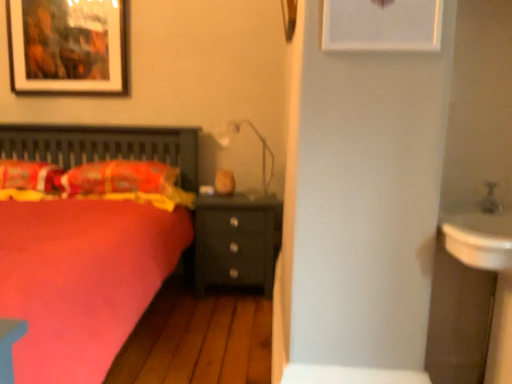
Question: From a real-world perspective, is fluffy orange pillow at left, which is counted as the first pillow, starting from the left, on matte black picture frame at upper left, acting as the 1th picture frame starting from the left?

Choices:
 (A) no
 (B) yes

Answer: (A)

Question: Is matte black picture frame at upper left, which is counted as the second picture frame, starting from the right, a part of fluffy orange pillow at left, which is the second pillow in right-to-left order?

Choices:
 (A) yes
 (B) no

Answer: (B)

Question: From a real-world perspective, does fluffy orange pillow at left, which is counted as the first pillow, starting from the left, sit lower than matte black picture frame at upper left, the 1th picture frame from the back?

Choices:
 (A) yes
 (B) no

Answer: (A)

Question: Considering the relative positions of fluffy orange pillow at left, which is counted as the first pillow, starting from the left, and matte black picture frame at upper left, which is counted as the second picture frame, starting from the right, in the image provided, is fluffy orange pillow at left, which is counted as the first pillow, starting from the left, to the right of matte black picture frame at upper left, which is counted as the second picture frame, starting from the right, from the viewer's perspective?

Choices:
 (A) no
 (B) yes

Answer: (A)

Question: Does fluffy orange pillow at left, which is counted as the first pillow, starting from the left, have a lesser width compared to matte black picture frame at upper left, the 1th picture frame from the back?

Choices:
 (A) no
 (B) yes

Answer: (A)

Question: From the image's perspective, does fluffy orange pillow at left, which is the second pillow in right-to-left order, appear lower than matte black picture frame at upper left, acting as the 1th picture frame starting from the left?

Choices:
 (A) yes
 (B) no

Answer: (A)

Question: Can you confirm if matte black picture frame at upper left, acting as the 1th picture frame starting from the left, is taller than matte white lamp at center?

Choices:
 (A) yes
 (B) no

Answer: (A)

Question: Considering the relative sizes of matte black picture frame at upper left, the 1th picture frame from the back, and matte white lamp at center in the image provided, is matte black picture frame at upper left, the 1th picture frame from the back, thinner than matte white lamp at center?

Choices:
 (A) yes
 (B) no

Answer: (A)

Question: Is matte black picture frame at upper left, the 1th picture frame from the back, far from matte white lamp at center?

Choices:
 (A) no
 (B) yes

Answer: (B)

Question: Is matte black picture frame at upper left, which is counted as the second picture frame, starting from the right, further to camera compared to matte white lamp at center?

Choices:
 (A) no
 (B) yes

Answer: (B)

Question: Is matte black picture frame at upper left, which appears as the second picture frame when viewed from the front, closer to the viewer compared to matte white lamp at center?

Choices:
 (A) no
 (B) yes

Answer: (A)

Question: Does matte black picture frame at upper left, which appears as the second picture frame when viewed from the front, have a larger size compared to matte white lamp at center?

Choices:
 (A) yes
 (B) no

Answer: (A)

Question: Does matte white lamp at center have a lesser width compared to fluffy orange pillow at left, which is counted as the first pillow, starting from the left?

Choices:
 (A) yes
 (B) no

Answer: (A)